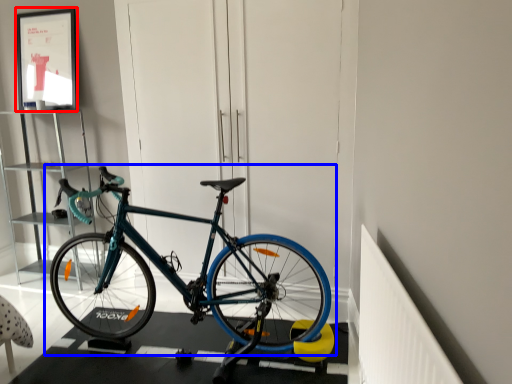
Question: Which point is further to the camera, picture frame (highlighted by a red box) or bicycle (highlighted by a blue box)?

Choices:
 (A) picture frame
 (B) bicycle

Answer: (A)